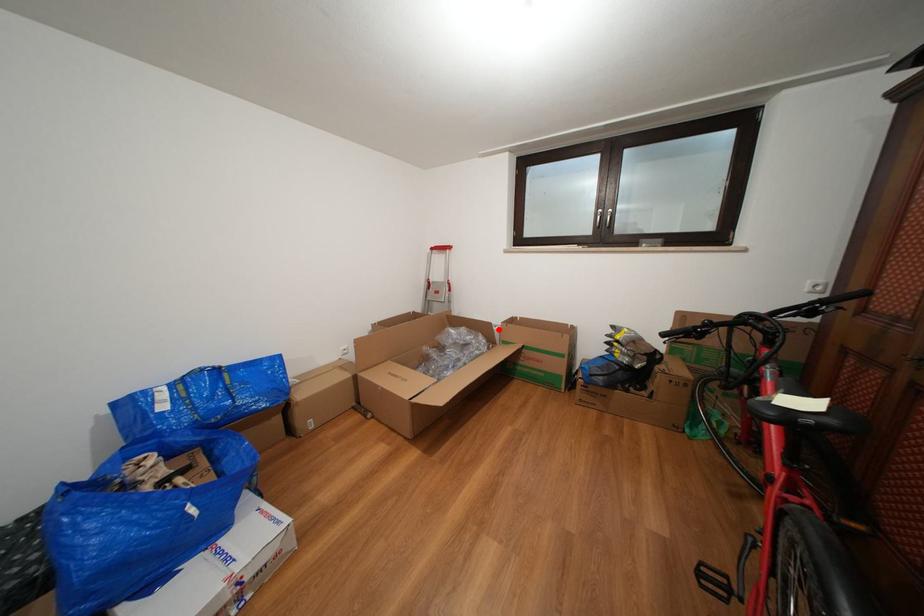
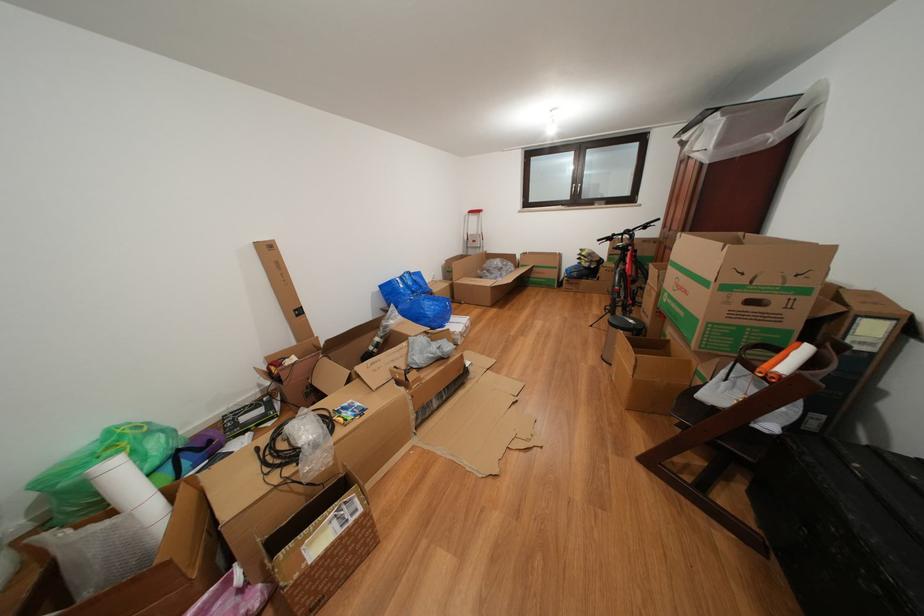
Question: I am providing you with two images of the same scene from different viewpoints. In image1, a red point is highlighted. Considering the same 3D point in image2, which of the following is correct?

Choices:
 (A) It is closer
 (B) It is farther

Answer: (A)